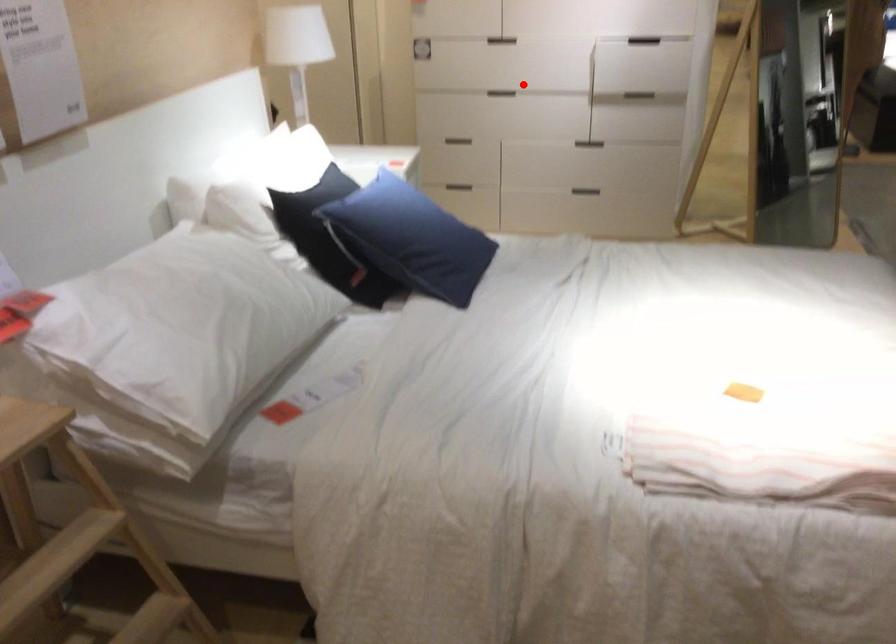
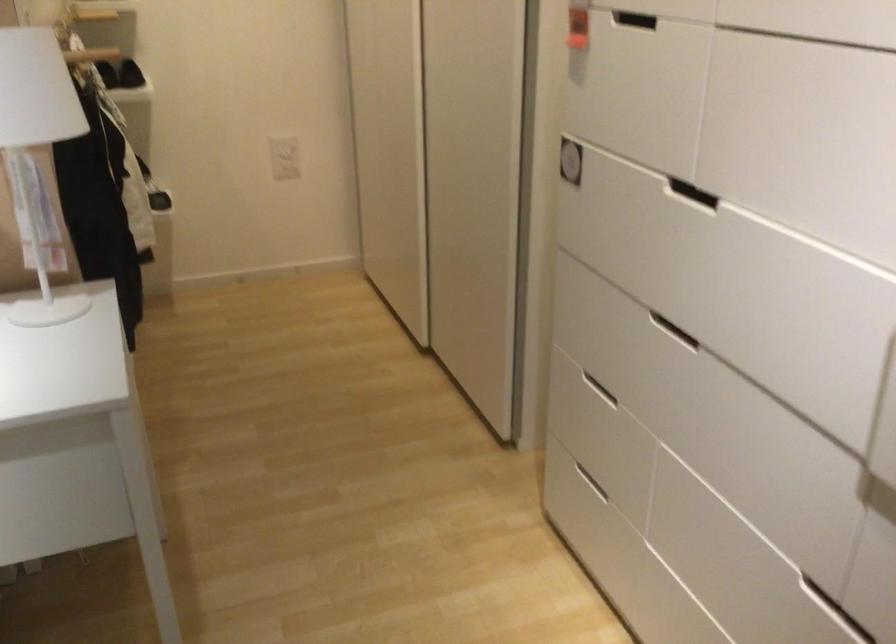
Question: I am providing you with two images of the same scene from different viewpoints. Image1 has a red point marked. In image2, the corresponding 3D location appears at what relative position? Reply with the corresponding letter.

Choices:
 (A) Closer
 (B) Farther

Answer: (A)